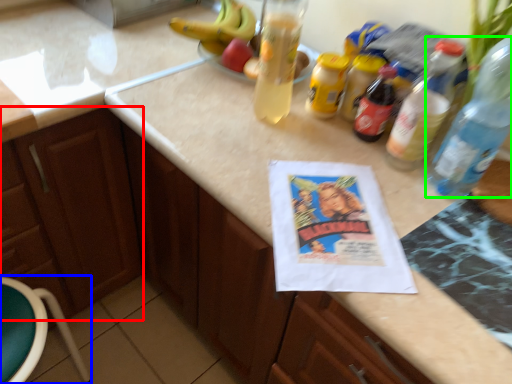
Question: Which object is the closest to the cabinetry (highlighted by a red box)? Choose among these: bar stool (highlighted by a blue box) or bottle (highlighted by a green box).

Choices:
 (A) bar stool
 (B) bottle

Answer: (A)